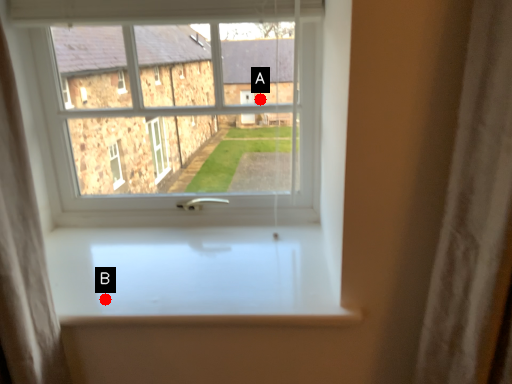
Question: Two points are circled on the image, labeled by A and B beside each circle. Which point is farther to the camera?

Choices:
 (A) A is further
 (B) B is further

Answer: (A)